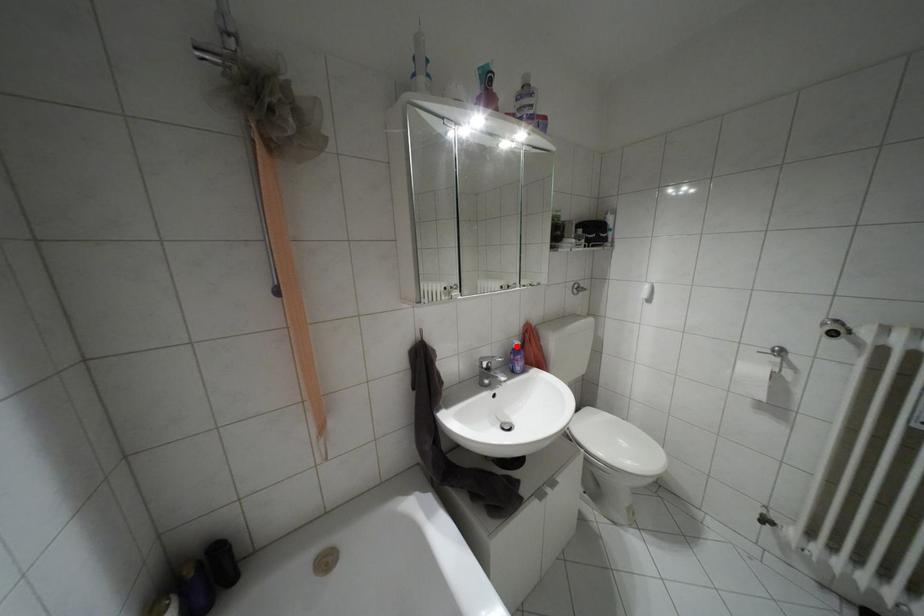
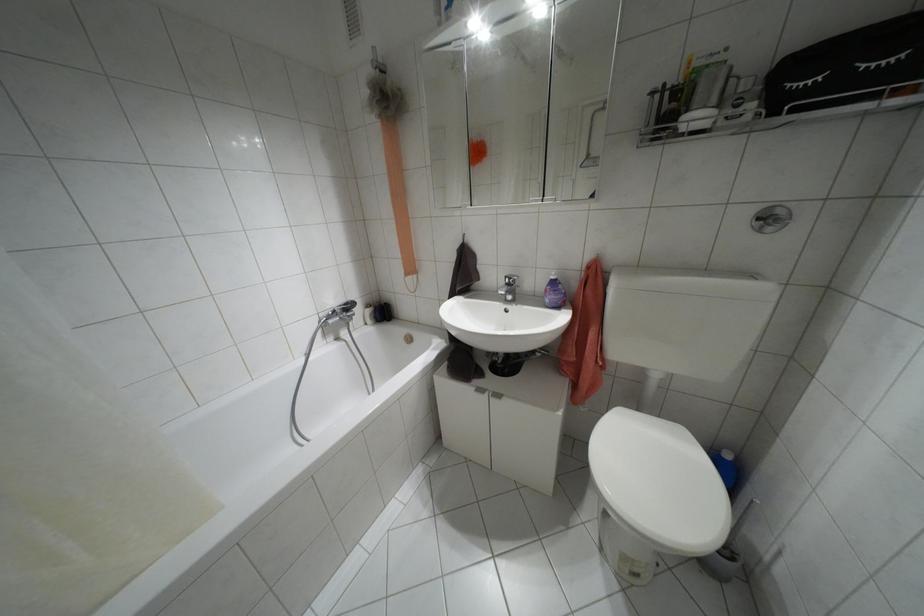
Locate, in the second image, the point that corresponds to the highlighted location in the first image.

(552, 277)